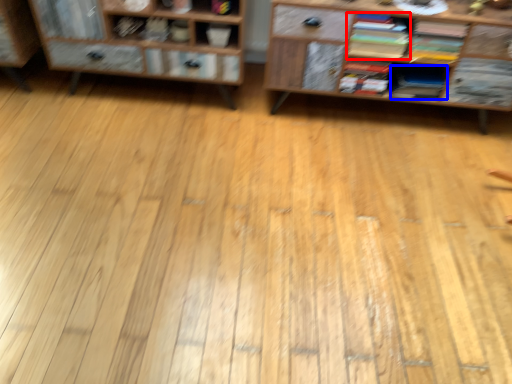
Question: Among these objects, which one is nearest to the camera, book (highlighted by a red box) or book (highlighted by a blue box)?

Choices:
 (A) book
 (B) book

Answer: (A)